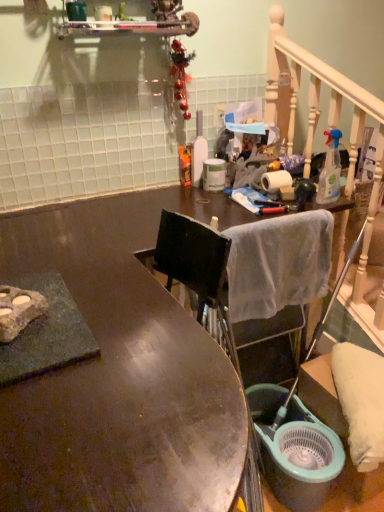
Question: Is shiny brown desk at center facing towards teal plastic bucket at lower right?

Choices:
 (A) yes
 (B) no

Answer: (B)

Question: From a real-world perspective, is shiny brown desk at center located higher than teal plastic bucket at lower right?

Choices:
 (A) yes
 (B) no

Answer: (A)

Question: Is shiny brown desk at center looking in the opposite direction of teal plastic bucket at lower right?

Choices:
 (A) yes
 (B) no

Answer: (B)

Question: Can you confirm if shiny brown desk at center is smaller than teal plastic bucket at lower right?

Choices:
 (A) no
 (B) yes

Answer: (A)

Question: Does shiny brown desk at center appear on the left side of teal plastic bucket at lower right?

Choices:
 (A) yes
 (B) no

Answer: (A)

Question: From the image's perspective, is shiny brown desk at center below teal plastic bucket at lower right?

Choices:
 (A) yes
 (B) no

Answer: (B)

Question: Does clear plastic spray bottle at upper right, acting as the 1th bottle starting from the right, have a smaller size compared to white soft towel at center?

Choices:
 (A) yes
 (B) no

Answer: (A)

Question: Is clear plastic spray bottle at upper right, acting as the 1th bottle starting from the right, far from white soft towel at center?

Choices:
 (A) no
 (B) yes

Answer: (A)

Question: Is clear plastic spray bottle at upper right, marked as the 2th bottle in a left-to-right arrangement, wider than white soft towel at center?

Choices:
 (A) yes
 (B) no

Answer: (B)

Question: Is clear plastic spray bottle at upper right, marked as the 2th bottle in a left-to-right arrangement, positioned behind white soft towel at center?

Choices:
 (A) no
 (B) yes

Answer: (B)

Question: From the image's perspective, is clear plastic spray bottle at upper right, positioned as the 2th bottle in back-to-front order, located beneath white soft towel at center?

Choices:
 (A) yes
 (B) no

Answer: (B)

Question: From the image's perspective, would you say clear plastic spray bottle at upper right, positioned as the 1th bottle in front-to-back order, is positioned over white soft towel at center?

Choices:
 (A) no
 (B) yes

Answer: (B)

Question: Is white soft towel at center shorter than teal plastic bucket at lower right?

Choices:
 (A) yes
 (B) no

Answer: (B)